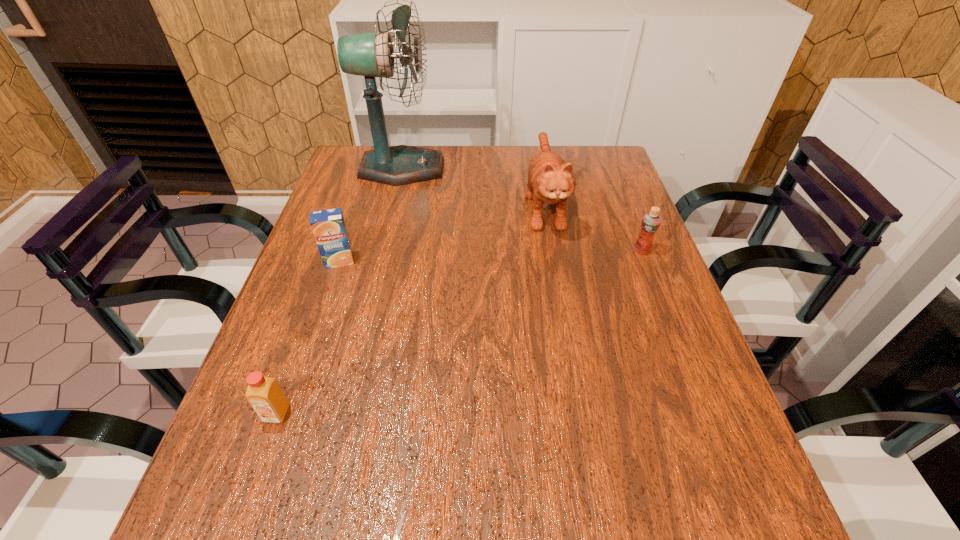
Identify the location of vacant space that satisfies the following two spatial constraints: 1. on the back side of the rightmost orange juice; 2. in front of the tallest object where the wind blows. (610, 168).

What are the coordinates of `free point that satisfies the following two spatial constraints: 1. in front of the rightmost object where the wind blows; 2. on the right side of the fan` in the screenshot? It's located at (383, 251).